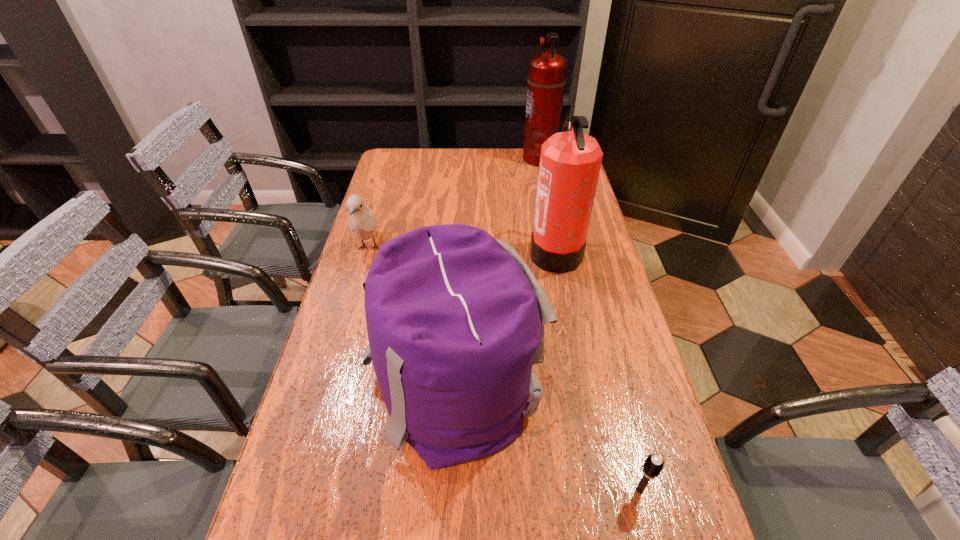
Identify the location of free spot between the hairbrush and the backpack. (546, 437).

Identify which object is the fourth nearest to the third shortest object. Please provide its 2D coordinates. Your answer should be formatted as a tuple, i.e. [(x, y)], where the tuple contains the x and y coordinates of a point satisfying the conditions above.

[(546, 80)]

Image resolution: width=960 pixels, height=540 pixels. I want to click on object that is the fourth closest to the nearer fire extinguisher, so click(x=653, y=465).

At what (x,y) coordinates should I click in order to perform the action: click on free point that satisfies the following two spatial constraints: 1. on the nozzle side of the shortest object; 2. on the left side of the farther fire extinguisher. Please return your answer as a coordinate pair (x, y). This screenshot has height=540, width=960. Looking at the image, I should click on (606, 490).

At what (x,y) coordinates should I click in order to perform the action: click on vacant region that satisfies the following two spatial constraints: 1. on the nozzle side of the farther fire extinguisher; 2. at the beak of the second shortest object. Please return your answer as a coordinate pair (x, y). Looking at the image, I should click on (557, 248).

Where is `vacant space that satisfies the following two spatial constraints: 1. on the nozzle side of the nearest object; 2. on the left side of the farthest object`? Image resolution: width=960 pixels, height=540 pixels. vacant space that satisfies the following two spatial constraints: 1. on the nozzle side of the nearest object; 2. on the left side of the farthest object is located at coordinates (606, 490).

Where is `blank area in the image that satisfies the following two spatial constraints: 1. on the nozzle side of the farthest object; 2. at the beak of the fourth tallest object`? This screenshot has width=960, height=540. blank area in the image that satisfies the following two spatial constraints: 1. on the nozzle side of the farthest object; 2. at the beak of the fourth tallest object is located at coordinates (557, 248).

The height and width of the screenshot is (540, 960). What are the coordinates of `free location that satisfies the following two spatial constraints: 1. on the nozzle side of the farthest object; 2. at the beak of the second shortest object` in the screenshot? It's located at (557, 248).

Where is `vacant point that satisfies the following two spatial constraints: 1. on the nozzle side of the farther fire extinguisher; 2. at the beak of the bird`? This screenshot has width=960, height=540. vacant point that satisfies the following two spatial constraints: 1. on the nozzle side of the farther fire extinguisher; 2. at the beak of the bird is located at coordinates (557, 248).